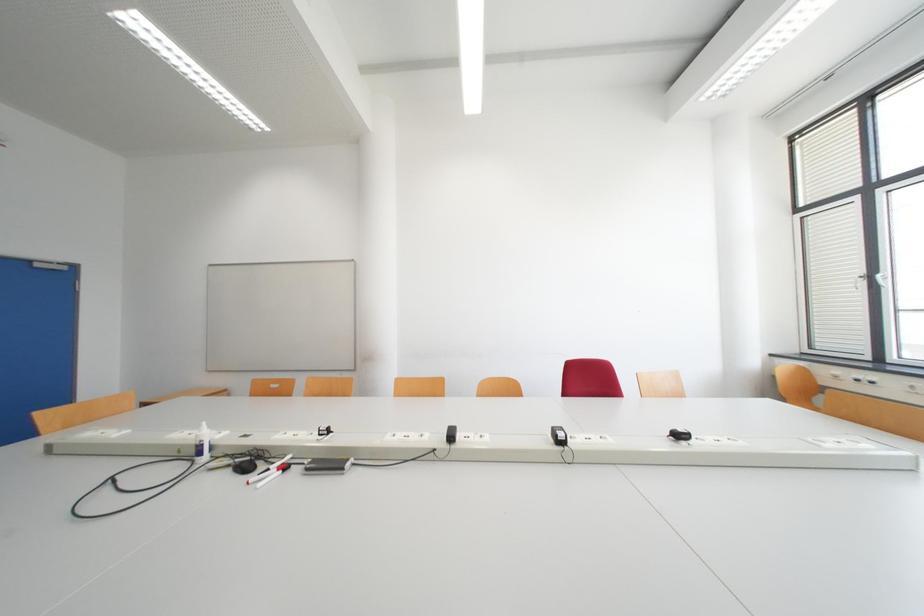
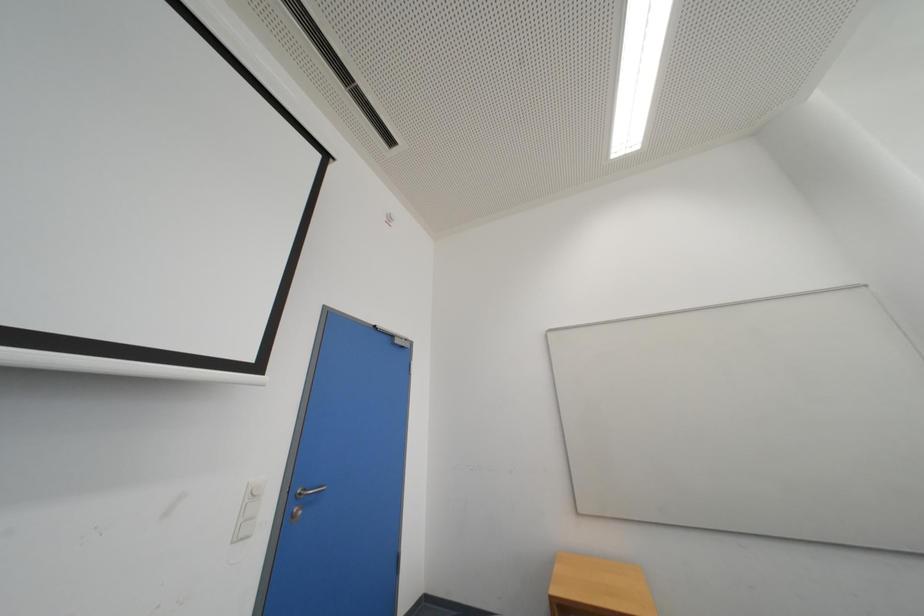
Question: In a continuous first-person perspective shot, in which direction is the camera moving?

Choices:
 (A) Left
 (B) Right
 (C) Forward
 (D) Backward

Answer: (A)